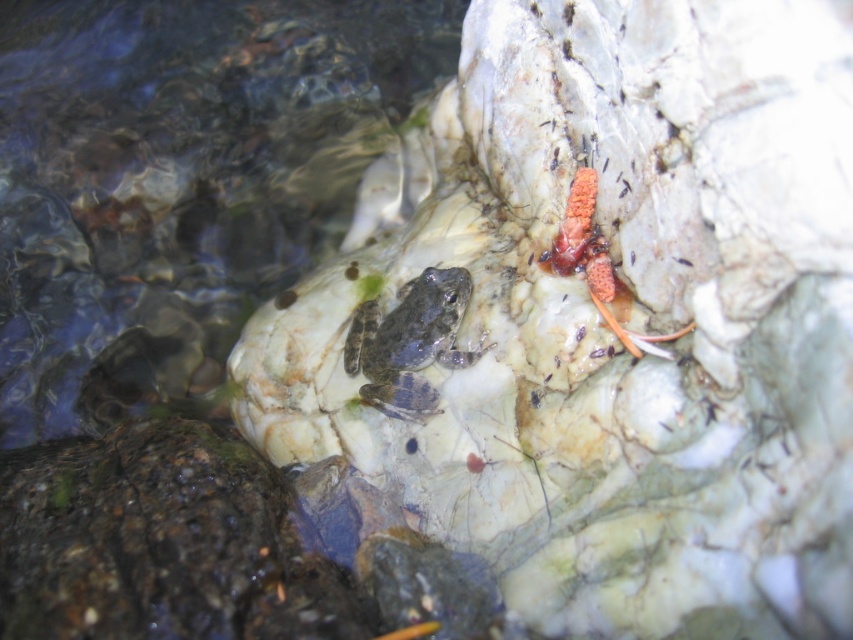
Question: Considering the relative positions of speckled stone at center and clear water at center in the image provided, where is speckled stone at center located with respect to clear water at center?

Choices:
 (A) right
 (B) left

Answer: (A)

Question: Which of these objects is positioned closest to the clear water at center?

Choices:
 (A) speckled gray frog at center
 (B) spongy orange coral at upper right
 (C) speckled stone at center

Answer: (C)

Question: Which point is closer to the camera?

Choices:
 (A) (556, 262)
 (B) (416, 330)

Answer: (A)

Question: Which of the following is the farthest from the observer?

Choices:
 (A) (415, 326)
 (B) (635, 353)

Answer: (A)

Question: Can you confirm if clear water at center is positioned to the right of speckled gray frog at center?

Choices:
 (A) yes
 (B) no

Answer: (B)

Question: Is clear water at center above spongy orange coral at upper right?

Choices:
 (A) no
 (B) yes

Answer: (B)